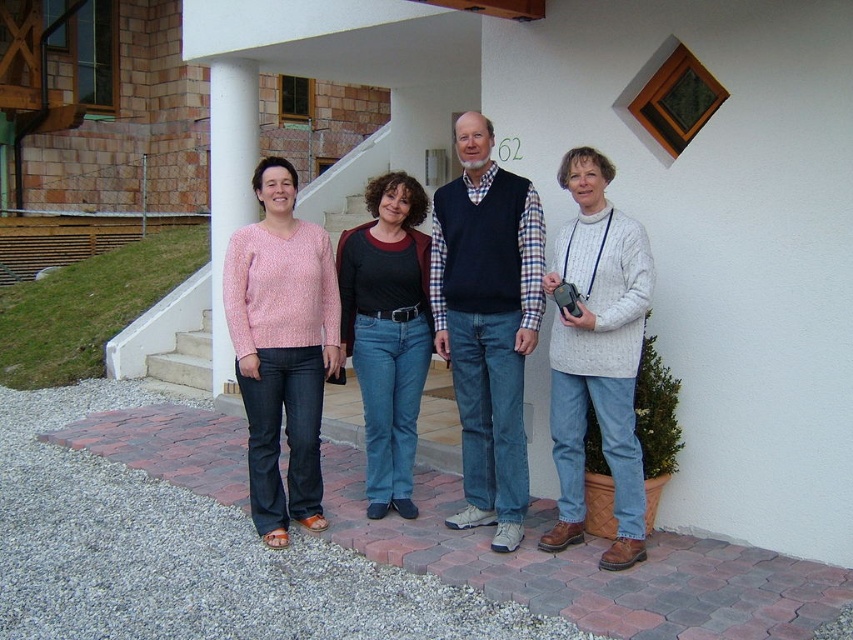
Question: Which object is positioned farthest from the blue jeans at center?

Choices:
 (A) pink knitted sweater at center
 (B) denim jeans at center

Answer: (A)

Question: Which of the following is the closest to the observer?

Choices:
 (A) pink knitted sweater at center
 (B) pink sweater at center
 (C) matte pink sweater at center

Answer: (C)

Question: Which is nearer to the matte pink sweater at center?

Choices:
 (A) denim jeans at center
 (B) pink knitted sweater at center
 (C) white knitted sweater at center
 (D) pink sweater at center

Answer: (C)

Question: Can you confirm if denim jeans at center is positioned to the right of pink sweater at center?

Choices:
 (A) yes
 (B) no

Answer: (A)

Question: In this image, where is blue jeans at center located relative to denim jeans at center?

Choices:
 (A) right
 (B) left

Answer: (A)

Question: Does matte pink sweater at center come behind blue jeans at center?

Choices:
 (A) yes
 (B) no

Answer: (B)